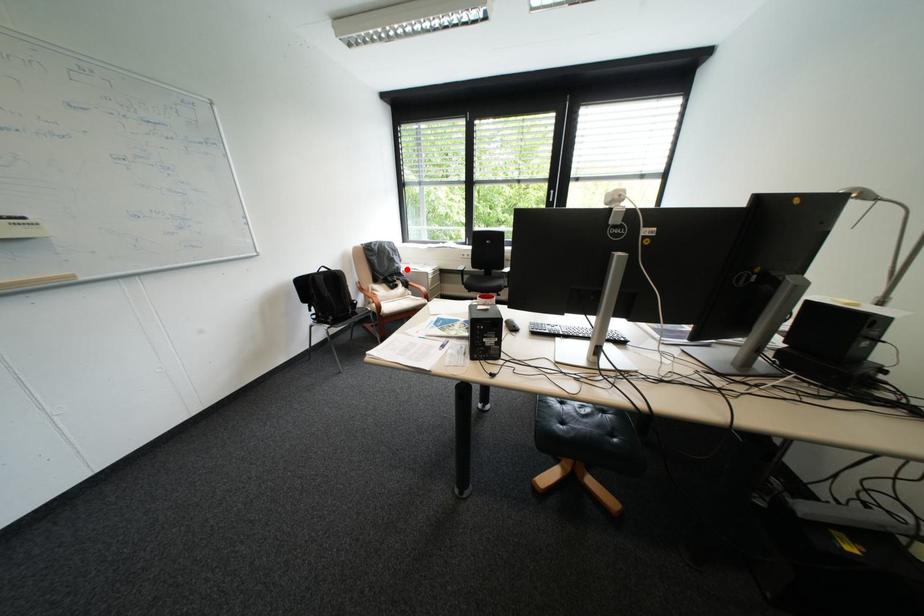
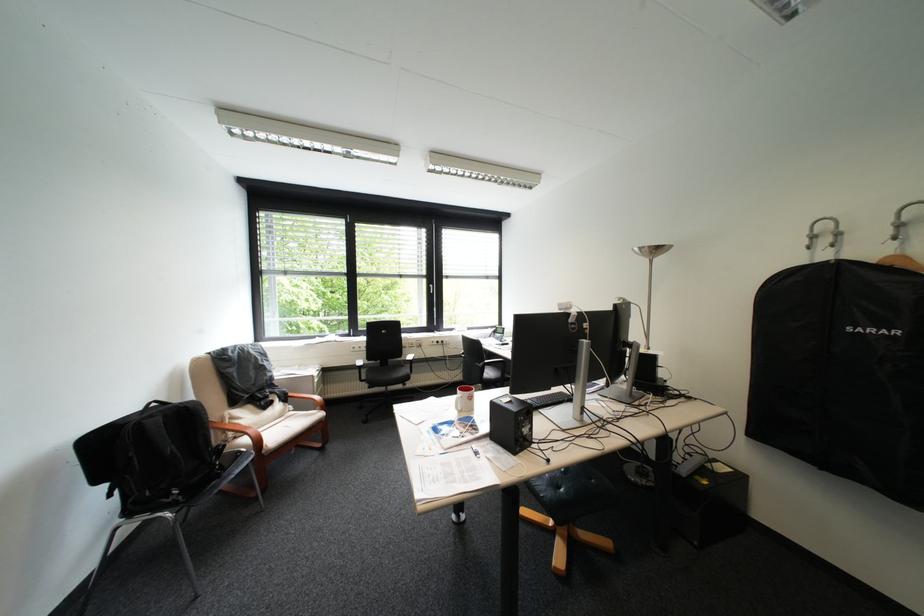
Where in the second image is the point corresponding to the highlighted location from the first image?

(280, 381)